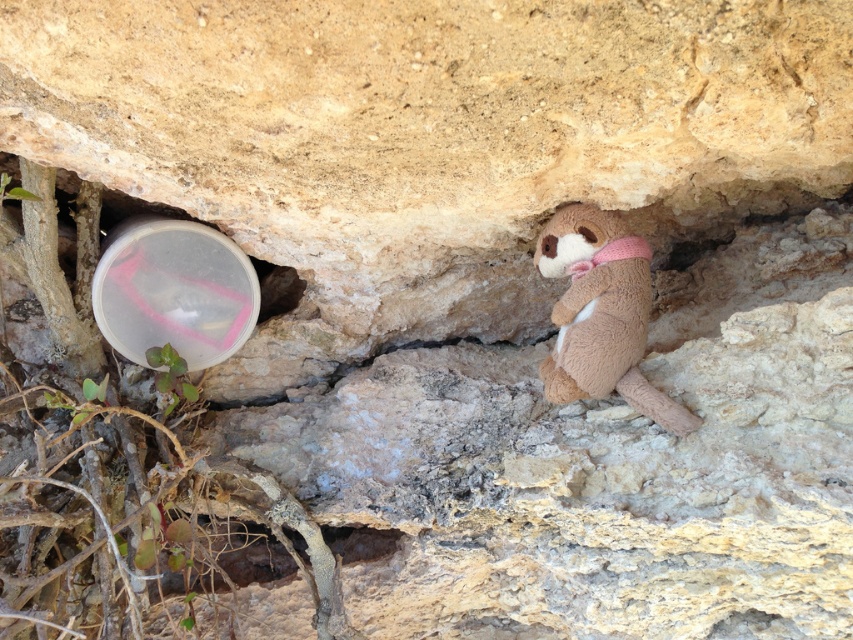
You are a hiker who found a brown plush toy at center and a smooth stone hole at center in a rocky area. Which object is taller?

The brown plush toy at center is much taller than the smooth stone hole at center.

You are a geologist examining the rocky terrain and need to place a marker at the exact center of the transparent plastic bubble at lower left. According to the coordinates provided, where should you place the marker?

The center of the transparent plastic bubble at lower left should be placed at the coordinates point (173, 291).